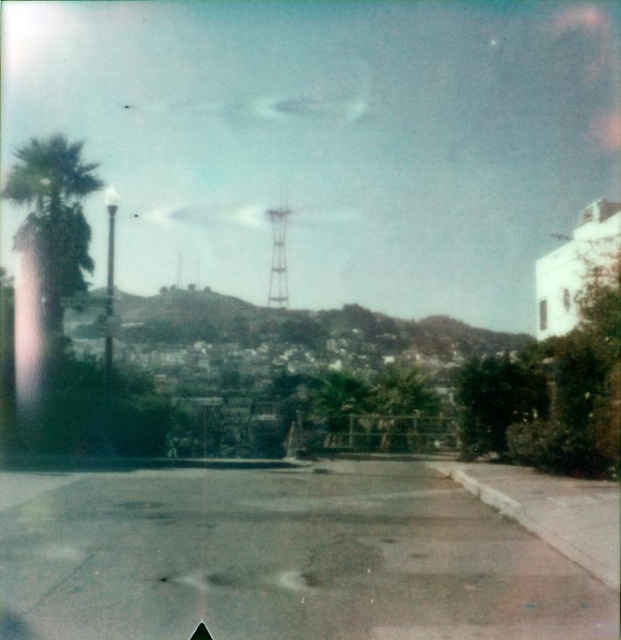
Question: Which of the following is the farthest from the observer?

Choices:
 (A) (37, 209)
 (B) (274, 259)

Answer: (B)

Question: Can you confirm if green leafy palm tree at left is positioned to the right of metallic water tower at center?

Choices:
 (A) no
 (B) yes

Answer: (A)

Question: Which point is closer to the camera?

Choices:
 (A) green leafy palm tree at left
 (B) metallic water tower at center

Answer: (A)

Question: Can you confirm if green leafy palm tree at left is smaller than metallic water tower at center?

Choices:
 (A) yes
 (B) no

Answer: (B)

Question: Can you confirm if green leafy palm tree at left is positioned below metallic water tower at center?

Choices:
 (A) no
 (B) yes

Answer: (A)